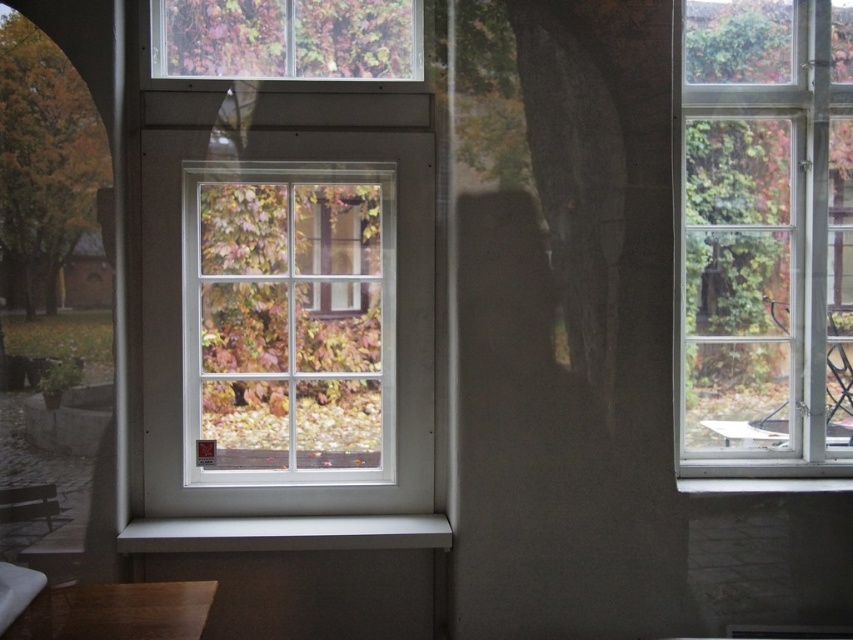
Can you confirm if white glass window at center is taller than wooden table at lower left?

Indeed, white glass window at center has a greater height compared to wooden table at lower left.

Between point (308, 376) and point (132, 627), which one is positioned in front?

Point (132, 627) is in front.

This screenshot has height=640, width=853. Identify the location of white glass window at center. (289, 317).

Find the location of a particular element. Image resolution: width=853 pixels, height=640 pixels. white glass window at center is located at coordinates (289, 317).

Is white glass window at center taller than white smooth window sill at center?

Yes, white glass window at center is taller than white smooth window sill at center.

Between point (308, 392) and point (312, 548), which one is positioned in front?

Point (312, 548) is in front.

The height and width of the screenshot is (640, 853). What are the coordinates of `white glass window at center` in the screenshot? It's located at (289, 317).

Is translucent glass window at upper center wider than wooden table at lower left?

Yes, translucent glass window at upper center is wider than wooden table at lower left.

Does point (415, 22) lie behind point (158, 589)?

Yes, point (415, 22) is behind point (158, 589).

What do you see at coordinates (287, 38) in the screenshot?
I see `translucent glass window at upper center` at bounding box center [287, 38].

Where is `translucent glass window at upper center`? translucent glass window at upper center is located at coordinates (287, 38).